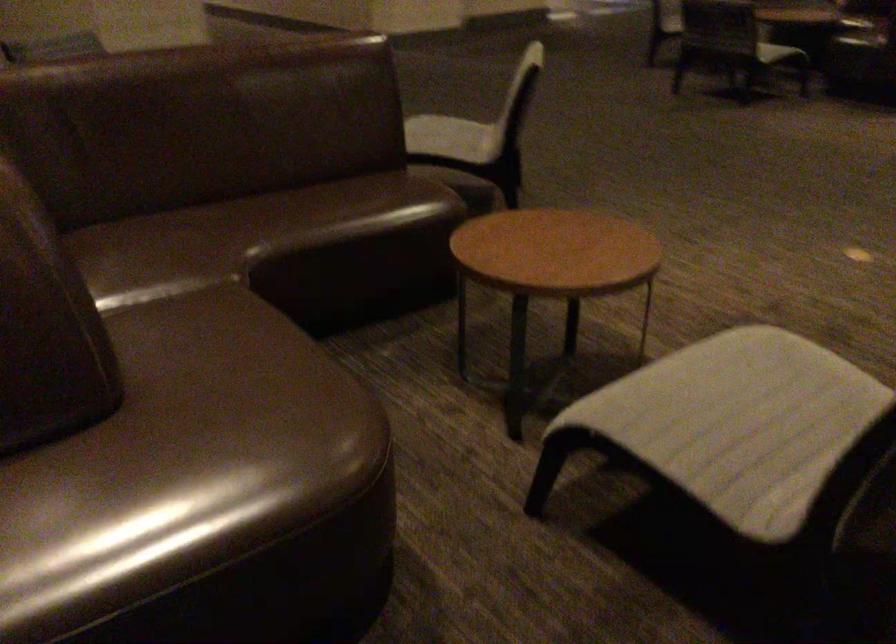
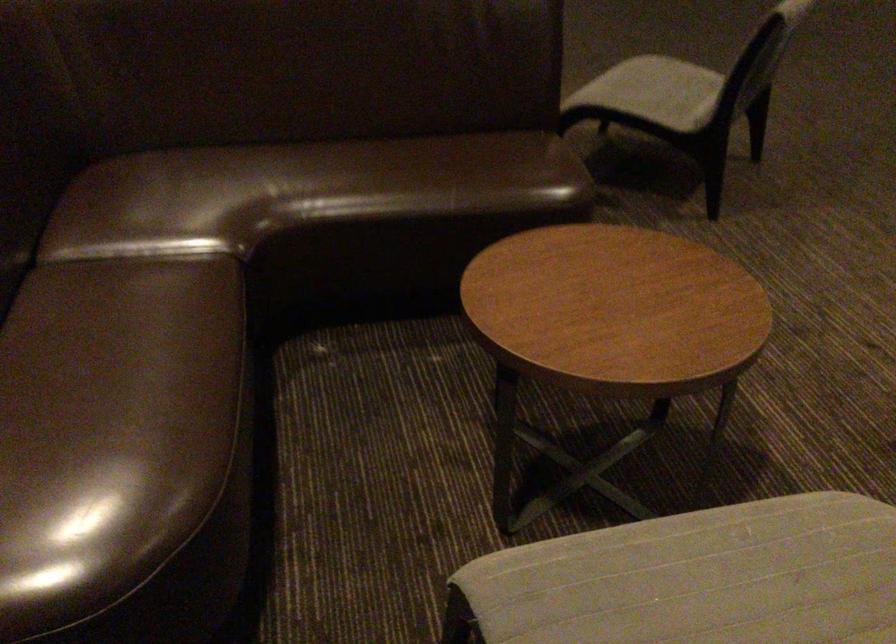
Locate, in the second image, the point that corresponds to the point at 294,383 in the first image.

(112, 426)